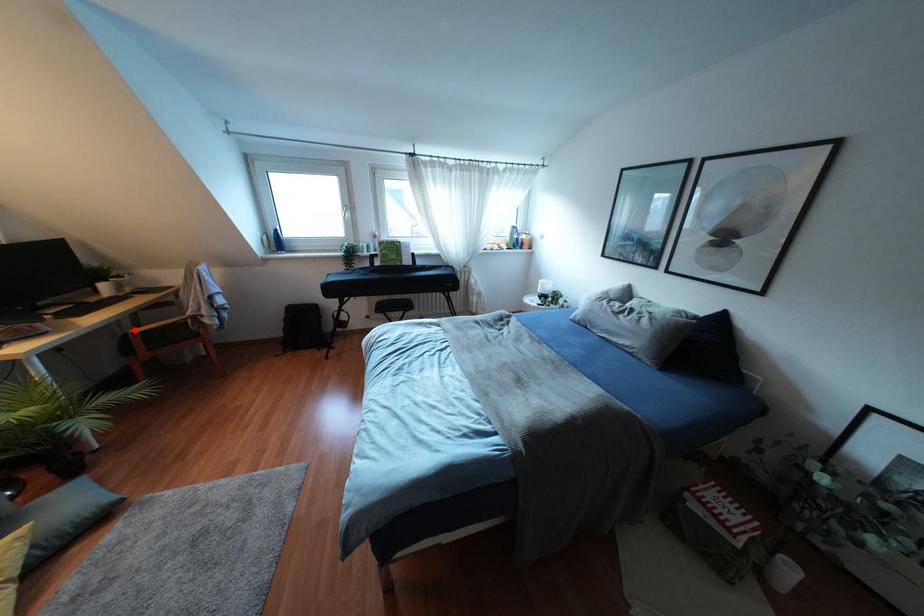
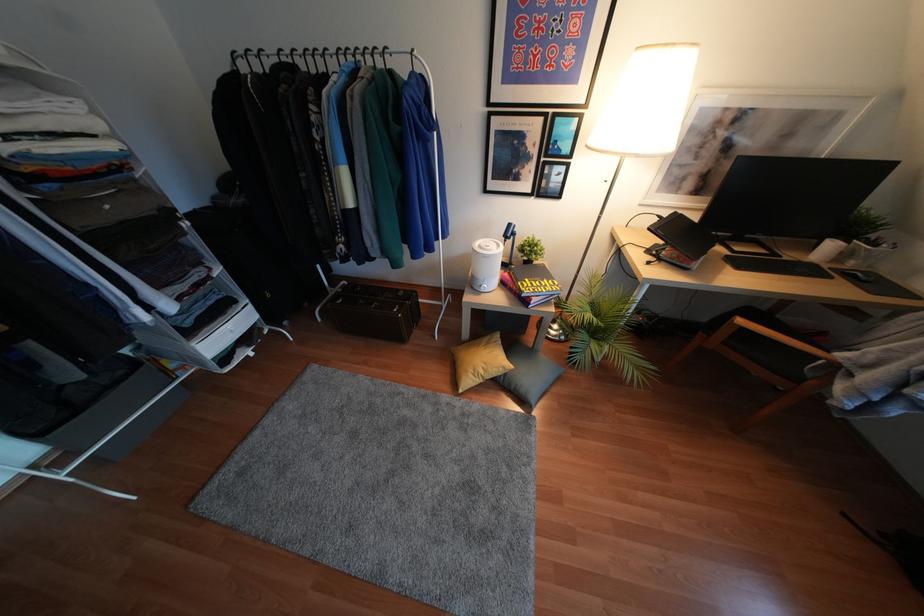
Question: I am providing you with two images of the same scene from different viewpoints. A red point is shown in image1. For the corresponding object point in image2, is it positioned nearer or farther from the camera?

Choices:
 (A) Nearer
 (B) Farther

Answer: (B)